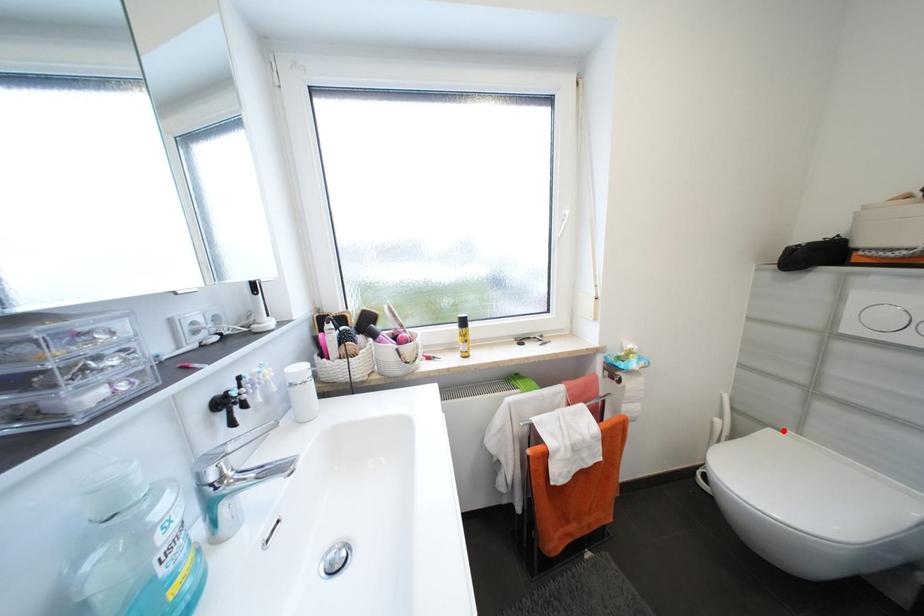
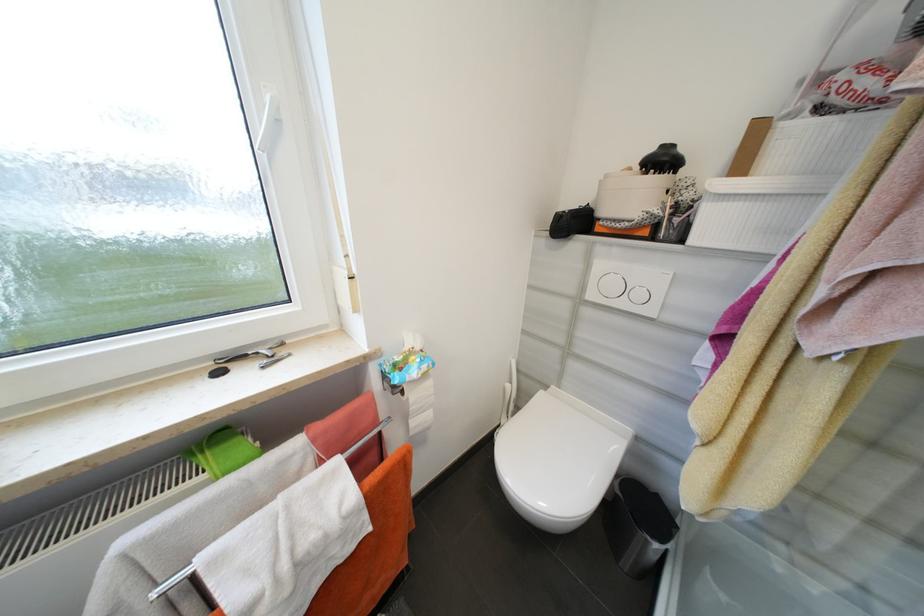
Find the pixel in the second image that matches the highlighted location in the first image.

(552, 387)